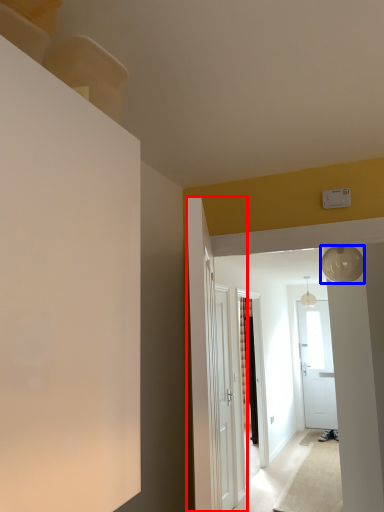
Question: Among these objects, which one is nearest to the camera, door (highlighted by a red box) or lamp (highlighted by a blue box)?

Choices:
 (A) door
 (B) lamp

Answer: (A)